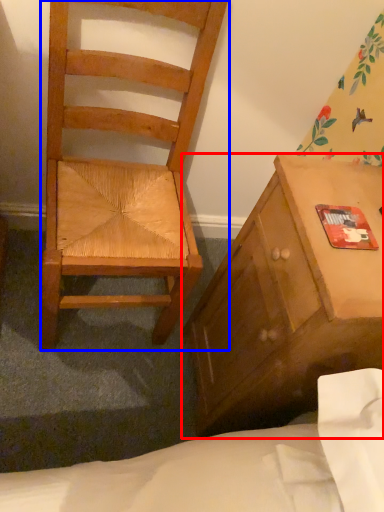
Question: Which object is further to the camera taking this photo, cabinetry (highlighted by a red box) or chair (highlighted by a blue box)?

Choices:
 (A) cabinetry
 (B) chair

Answer: (A)